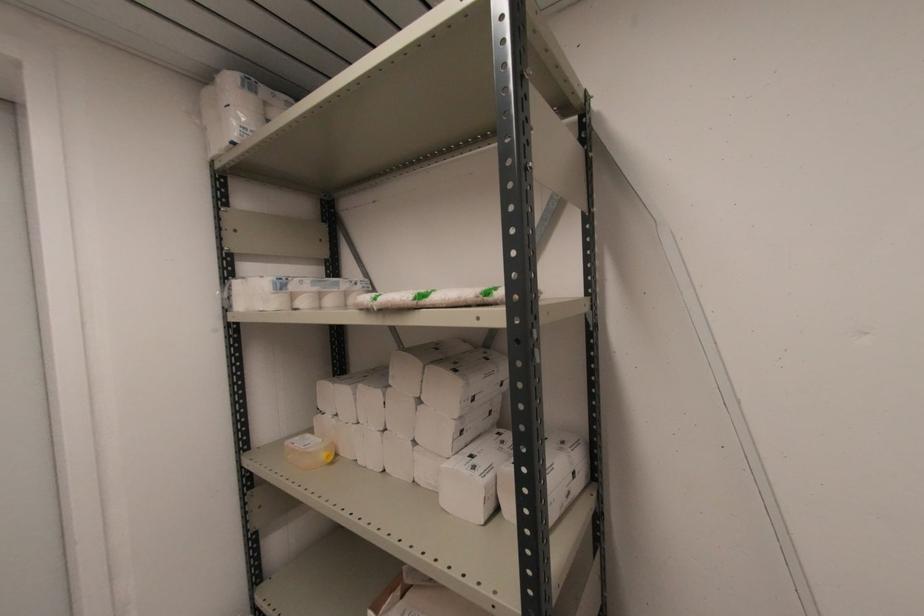
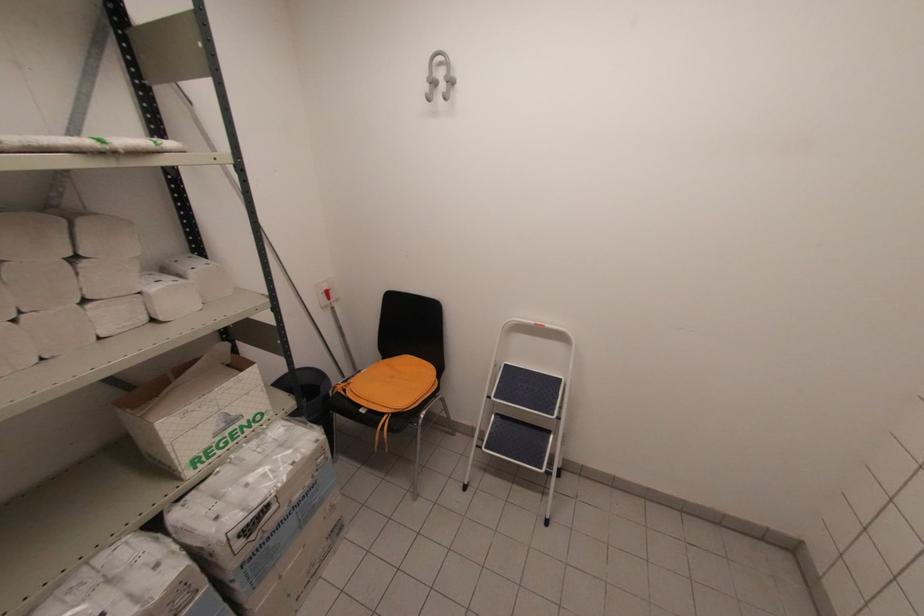
Where in the second image is the point corresponding to point 423,399 from the first image?

(81, 254)